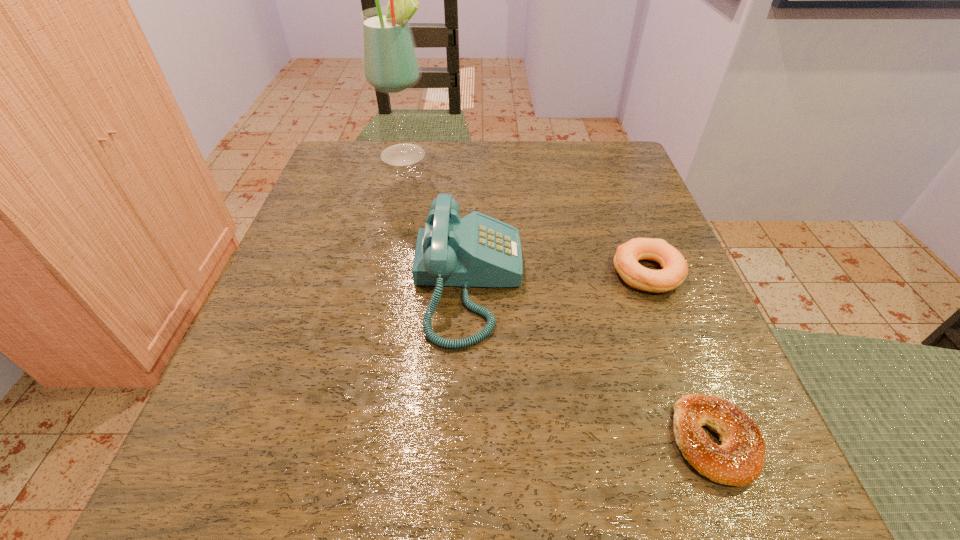
Find the location of `vacant space located 0.240m on the left of the nearest object`. vacant space located 0.240m on the left of the nearest object is located at coordinates (485, 441).

You are a GUI agent. You are given a task and a screenshot of the screen. Output one action in this format:
    pyautogui.click(x=<x>, y=<y>)
    Task: Click on the object positioned at the far edge
    Image resolution: width=960 pixels, height=540 pixels.
    Given the screenshot: What is the action you would take?
    pyautogui.click(x=390, y=64)

Locate an element on the screen. The height and width of the screenshot is (540, 960). object that is at the near edge is located at coordinates (739, 460).

This screenshot has height=540, width=960. I want to click on object located at the left edge, so click(x=390, y=64).

This screenshot has height=540, width=960. In order to click on object that is at the far left corner in this screenshot , I will do `click(390, 64)`.

The height and width of the screenshot is (540, 960). What are the coordinates of `object located at the near right corner` in the screenshot? It's located at (739, 460).

Identify the location of vacant space at the far edge of the desktop. (466, 156).

At what (x,y) coordinates should I click in order to perform the action: click on vacant area at the left edge. Please return your answer as a coordinate pair (x, y). The height and width of the screenshot is (540, 960). Looking at the image, I should click on (332, 227).

This screenshot has height=540, width=960. I want to click on free region at the right edge of the desktop, so click(621, 307).

The image size is (960, 540). In order to click on vacant space at the far left corner in this screenshot , I will do `click(383, 146)`.